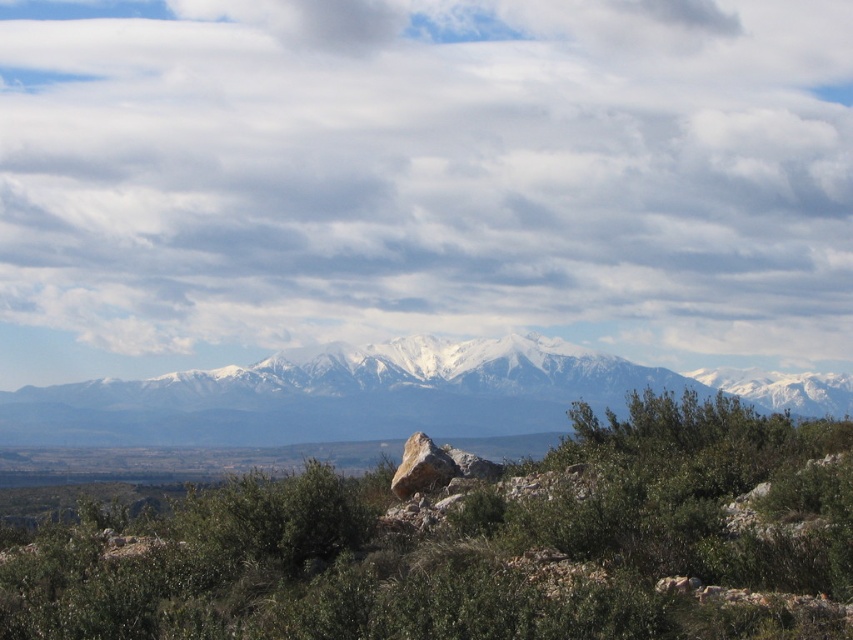
Question: Which of these objects is positioned farthest from the green leafy shrubs at center?

Choices:
 (A) snowy white mountain range at center
 (B) smooth gray rock at center
 (C) cloudy sky at upper center

Answer: (C)

Question: Can you confirm if cloudy sky at upper center is bigger than green leafy shrubs at center?

Choices:
 (A) yes
 (B) no

Answer: (A)

Question: Does green leafy shrubs at center appear under smooth gray rock at center?

Choices:
 (A) no
 (B) yes

Answer: (B)

Question: Which object is farther from the camera taking this photo?

Choices:
 (A) green leafy shrubs at center
 (B) smooth gray rock at center
 (C) snowy white mountain range at center

Answer: (C)

Question: Which point is closer to the camera?

Choices:
 (A) smooth gray rock at center
 (B) green leafy shrubs at center
 (C) snowy white mountain range at center

Answer: (B)

Question: In this image, where is cloudy sky at upper center located relative to green leafy shrubs at center?

Choices:
 (A) left
 (B) right

Answer: (B)